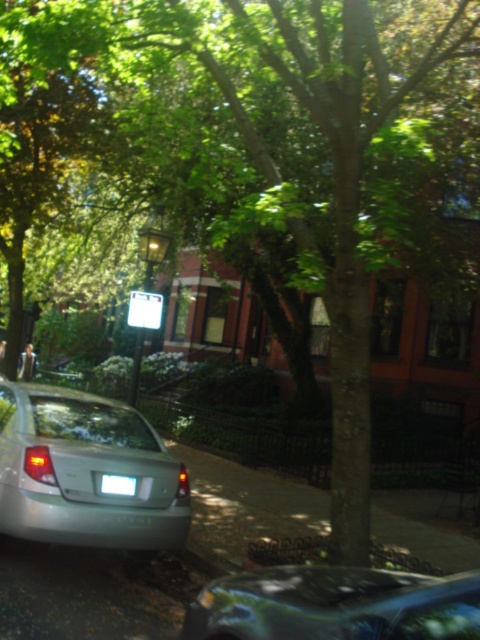
Question: Can you confirm if satin silver sedan at center is wider than metallic blue car at lower center?

Choices:
 (A) yes
 (B) no

Answer: (A)

Question: Which object is positioned closest to the satin silver sedan at center?

Choices:
 (A) metallic blue car at lower center
 (B) white plastic license plate at lower center

Answer: (B)

Question: Can you confirm if satin silver sedan at center is positioned below white plastic license plate at lower center?

Choices:
 (A) yes
 (B) no

Answer: (B)

Question: Can you confirm if satin silver sedan at center is bigger than white plastic license plate at lower center?

Choices:
 (A) no
 (B) yes

Answer: (B)

Question: Which point appears farthest from the camera in this image?

Choices:
 (A) (126, 492)
 (B) (372, 602)
 (C) (155, 480)

Answer: (C)

Question: Based on their relative distances, which object is farther from the satin silver sedan at center?

Choices:
 (A) white plastic license plate at lower center
 (B) metallic blue car at lower center

Answer: (B)